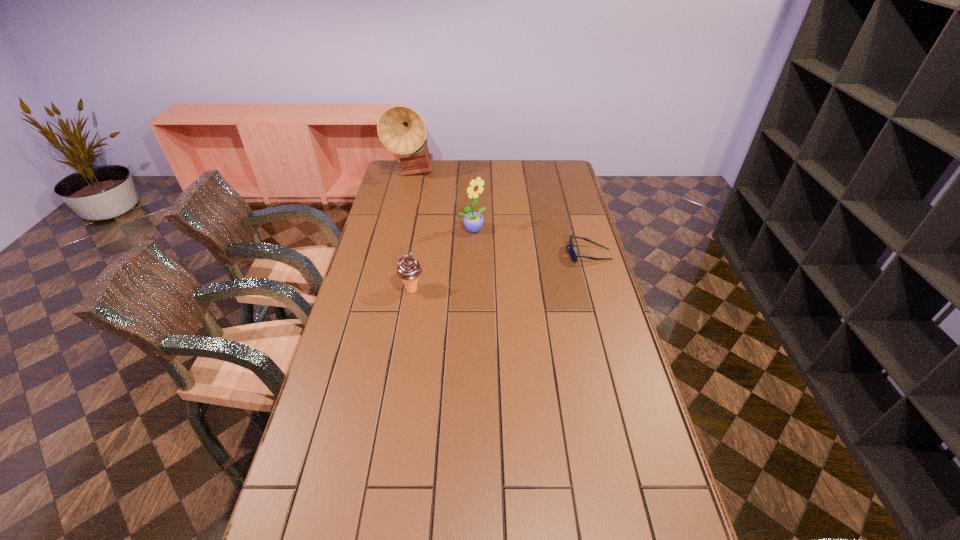
The height and width of the screenshot is (540, 960). Find the location of `free space between the third object from left to right and the tallest object`. free space between the third object from left to right and the tallest object is located at coordinates 442,201.

The height and width of the screenshot is (540, 960). I want to click on free space between the second nearest object and the farthest object, so pos(500,213).

Where is `empty space between the icecream and the sunflower`? empty space between the icecream and the sunflower is located at coordinates point(443,260).

You are a GUI agent. You are given a task and a screenshot of the screen. Output one action in this format:
    pyautogui.click(x=<x>, y=<y>)
    Task: Click on the free spot between the farthest object and the nearest object
    
    Given the screenshot: What is the action you would take?
    pyautogui.click(x=412, y=231)

Identify the location of vacant space that's between the second farthest object and the second shortest object. Image resolution: width=960 pixels, height=540 pixels. (x=443, y=260).

The height and width of the screenshot is (540, 960). What are the coordinates of `vacant point located between the third shortest object and the tallest object` in the screenshot? It's located at (442, 201).

Where is `vacant region between the phonograph record and the third tallest object`? vacant region between the phonograph record and the third tallest object is located at coordinates (412, 231).

Where is `object that is the second closest to the third nearest object`? This screenshot has height=540, width=960. object that is the second closest to the third nearest object is located at coordinates (573, 254).

I want to click on object that stands as the closest to the second shortest object, so click(x=473, y=222).

At what (x,y) coordinates should I click in order to perform the action: click on vacant area that satisfies the following two spatial constraints: 1. on the back side of the third tallest object; 2. on the left side of the second object from right to left. Please return your answer as a coordinate pair (x, y). Image resolution: width=960 pixels, height=540 pixels. Looking at the image, I should click on (421, 230).